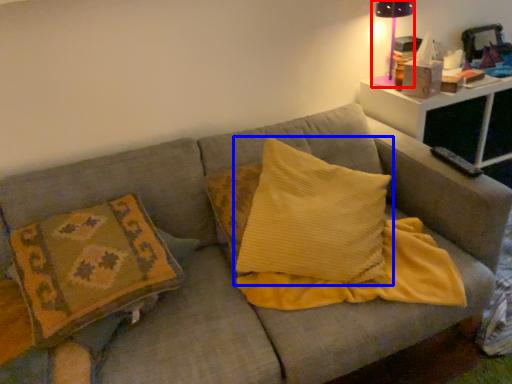
Question: Which object appears farthest to the camera in this image, table lamp (highlighted by a red box) or pillow (highlighted by a blue box)?

Choices:
 (A) table lamp
 (B) pillow

Answer: (A)